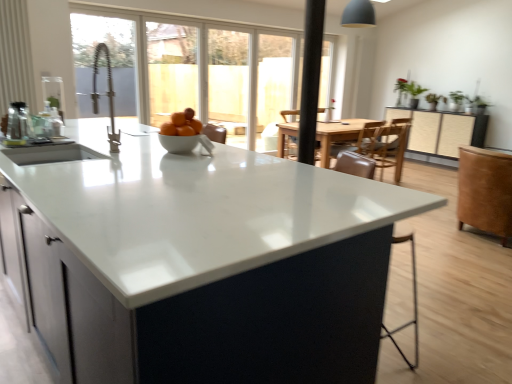
Question: Is black matte faucet at upper left, the 1th window screen viewed from the front, bigger or smaller than white glossy countertop at center?

Choices:
 (A) big
 (B) small

Answer: (B)

Question: Looking at their shapes, would you say black matte faucet at upper left, which ranks as the second window screen in back-to-front order, is wider or thinner than white glossy countertop at center?

Choices:
 (A) wide
 (B) thin

Answer: (B)

Question: Which of these objects is positioned closest to the wooden screen at center, arranged as the first window screen when viewed from the back?

Choices:
 (A) brown leather armchair at center
 (B) white glossy countertop at center
 (C) brown leather swivel chair at right
 (D) black matte faucet at upper left, which ranks as the second window screen in back-to-front order
 (E) matte black cabinet at center

Answer: (D)

Question: Which object is positioned farthest from the black matte pole at center?

Choices:
 (A) brown leather swivel chair at right
 (B) wooden screen at center, acting as the second window screen starting from the front
 (C) brown leather armchair at center
 (D) white glossy bowl at center
 (E) matte white bowl at center

Answer: (B)